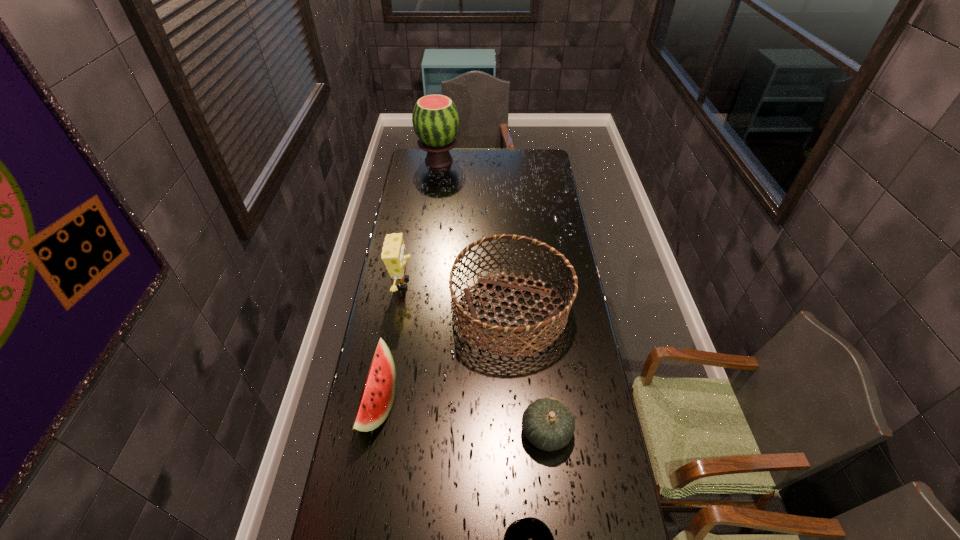
Where is `free space that satisfies the following two spatial constraints: 1. on the back side of the gourd; 2. on the outer rind of the shorter watermelon`? The height and width of the screenshot is (540, 960). free space that satisfies the following two spatial constraints: 1. on the back side of the gourd; 2. on the outer rind of the shorter watermelon is located at coordinates (543, 404).